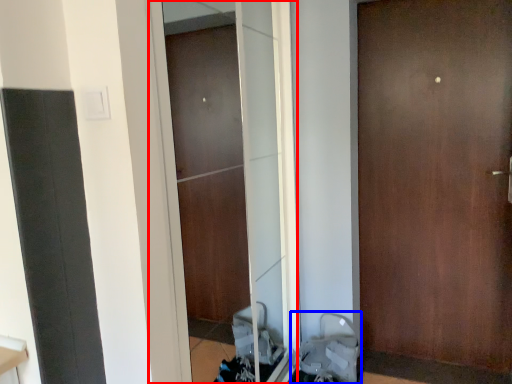
Question: Which point is further to the camera, screen door (highlighted by a red box) or baby carriage (highlighted by a blue box)?

Choices:
 (A) screen door
 (B) baby carriage

Answer: (B)